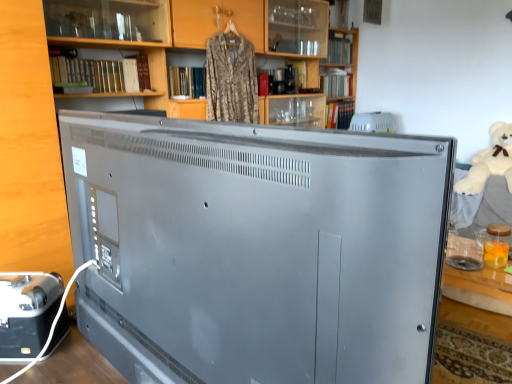
At what (x,y) coordinates should I click in order to perform the action: click on empty space that is ontop of metallic silver toaster at lower left, which ranks as the 2th appliance in top-to-bottom order (from a real-world perspective). Please return your answer as a coordinate pair (x, y). Image resolution: width=512 pixels, height=384 pixels. Looking at the image, I should click on (26, 282).